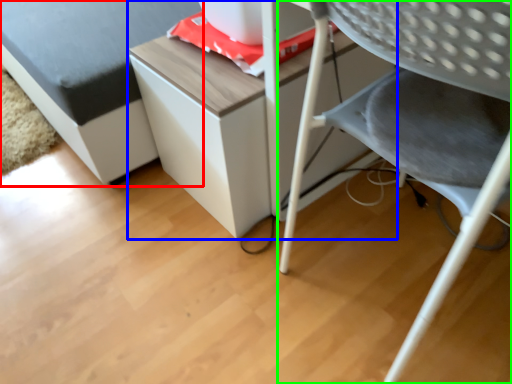
Question: Considering the real-world distances, which object is closest to furniture (highlighted by a red box)? table (highlighted by a blue box) or chair (highlighted by a green box).

Choices:
 (A) table
 (B) chair

Answer: (A)